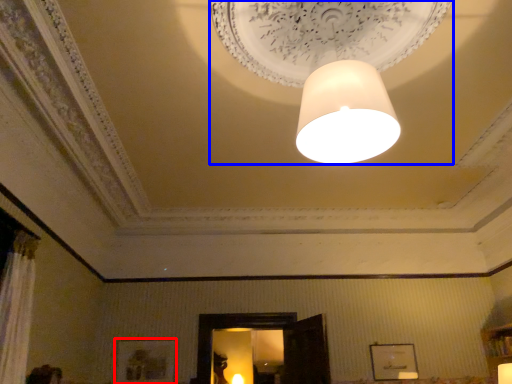
Question: Which of the following is the farthest to the observer, picture frame (highlighted by a red box) or lamp (highlighted by a blue box)?

Choices:
 (A) picture frame
 (B) lamp

Answer: (A)